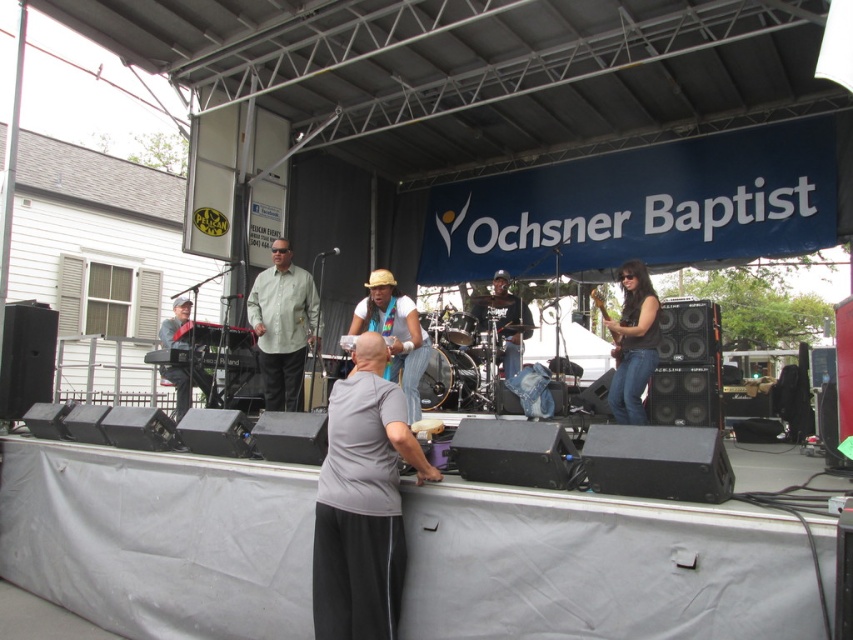
Question: Estimate the real-world distances between objects in this image. Which object is closer to the denim jeans at center?

Choices:
 (A) matte green shirt at center
 (B) matte straw hat at center
 (C) gray matte shirt at center

Answer: (B)

Question: Does matte green shirt at center have a larger size compared to matte straw hat at center?

Choices:
 (A) no
 (B) yes

Answer: (B)

Question: Which object appears farthest from the camera in this image?

Choices:
 (A) matte green shirt at center
 (B) wooden electric guitar at center

Answer: (A)

Question: Is gray matte shirt at center above wooden electric guitar at center?

Choices:
 (A) no
 (B) yes

Answer: (A)

Question: Estimate the real-world distances between objects in this image. Which object is closer to the gray matte shirt at center?

Choices:
 (A) wooden electric guitar at center
 (B) denim jeans at center
 (C) matte straw hat at center

Answer: (C)

Question: Can you confirm if matte green shirt at center is positioned above denim jeans at center?

Choices:
 (A) yes
 (B) no

Answer: (A)